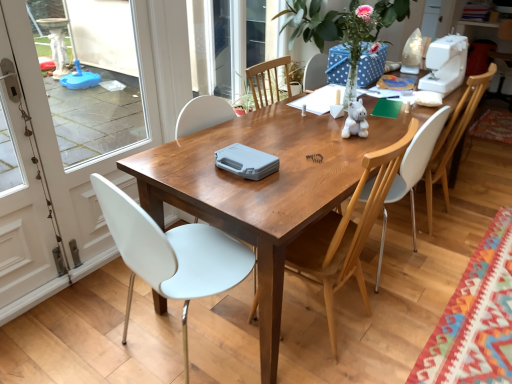
Question: Should I look upward or downward to see white plastic chair at left, which appears as the 4th chair when viewed from the right?

Choices:
 (A) up
 (B) down

Answer: (B)

Question: Can we say white plastic sewing machine at upper right lies outside white glossy screen door at left, the second screen door in the left-to-right sequence?

Choices:
 (A) no
 (B) yes

Answer: (B)

Question: Is white plastic sewing machine at upper right closer to camera compared to white glossy screen door at left, the second screen door in the left-to-right sequence?

Choices:
 (A) yes
 (B) no

Answer: (B)

Question: Would you consider white plastic sewing machine at upper right to be distant from white glossy screen door at left, which ranks as the first screen door in right-to-left order?

Choices:
 (A) yes
 (B) no

Answer: (A)

Question: Does white plastic sewing machine at upper right have a greater height compared to white glossy screen door at left, which ranks as the first screen door in right-to-left order?

Choices:
 (A) yes
 (B) no

Answer: (B)

Question: Is white plastic sewing machine at upper right looking in the opposite direction of white glossy screen door at left, the second screen door in the left-to-right sequence?

Choices:
 (A) no
 (B) yes

Answer: (A)

Question: Does white plastic sewing machine at upper right have a greater width compared to white glossy screen door at left, which ranks as the first screen door in right-to-left order?

Choices:
 (A) no
 (B) yes

Answer: (B)

Question: Does white glossy screen door at left, the second screen door in the left-to-right sequence, turn towards wooden chair at center, the second chair viewed from the left?

Choices:
 (A) no
 (B) yes

Answer: (B)

Question: Can you confirm if white glossy screen door at left, the second screen door in the left-to-right sequence, is shorter than wooden chair at center, the second chair viewed from the left?

Choices:
 (A) yes
 (B) no

Answer: (B)

Question: Is white glossy screen door at left, which ranks as the first screen door in right-to-left order, completely or partially outside of wooden chair at center, the third chair viewed from the right?

Choices:
 (A) yes
 (B) no

Answer: (A)

Question: From the image's perspective, is white glossy screen door at left, the second screen door in the left-to-right sequence, located above wooden chair at center, the third chair viewed from the right?

Choices:
 (A) no
 (B) yes

Answer: (B)

Question: Does white glossy screen door at left, the second screen door in the left-to-right sequence, appear on the right side of wooden chair at center, the third chair viewed from the right?

Choices:
 (A) yes
 (B) no

Answer: (B)

Question: Would you consider white glossy screen door at left, which ranks as the first screen door in right-to-left order, to be distant from wooden chair at center, the second chair viewed from the left?

Choices:
 (A) no
 (B) yes

Answer: (B)

Question: Would you consider white glossy screen door at left, which ranks as the second screen door in right-to-left order, to be distant from white plastic chair at center, the third chair when ordered from left to right?

Choices:
 (A) no
 (B) yes

Answer: (B)